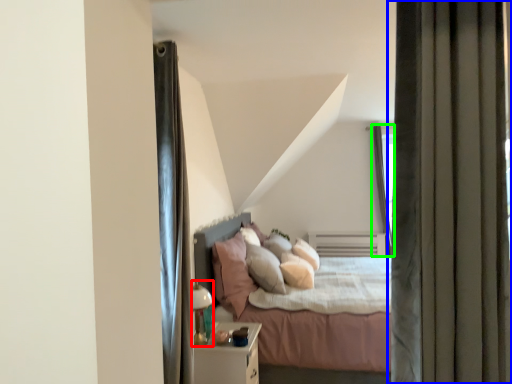
Question: Which object is positioned closest to lamp (highlighted by a red box)? Select from curtain (highlighted by a blue box) and glass door (highlighted by a green box).

Choices:
 (A) curtain
 (B) glass door

Answer: (A)